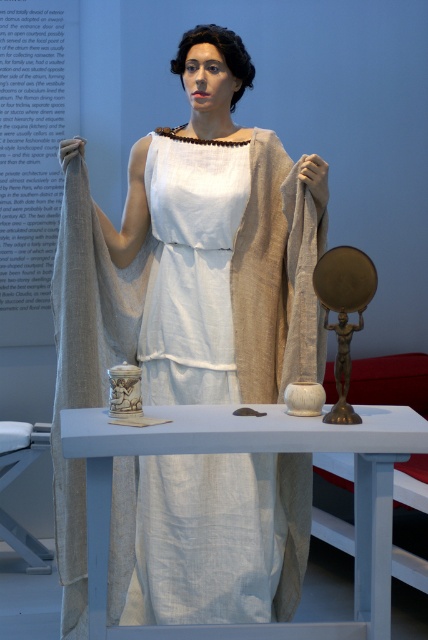
You are a photographer standing at a certain distance from the matte white dress at center. You want to capture a closeup shot of the dress without moving closer than 3 meters. Is the current distance sufficient?

The matte white dress at center is 3.55 meters away from the camera. Since 3.55 meters is greater than the 3 meters minimum distance you want to maintain, the current distance is sufficient for a closeup without moving closer.

What is the position of the point with coordinates (184, 273) relative to the matte white dress at center?

The point with coordinates (184, 273) is located on the matte white dress at center.